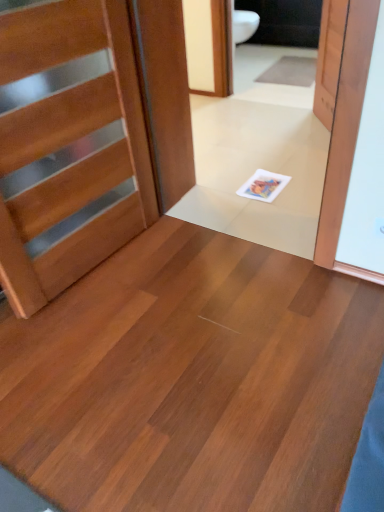
Question: Considering the relative sizes of wooden door at upper right, the 2th door when ordered from left to right, and gray carpet at upper center in the image provided, is wooden door at upper right, the 2th door when ordered from left to right, shorter than gray carpet at upper center?

Choices:
 (A) no
 (B) yes

Answer: (A)

Question: From the image's perspective, is wooden door at upper right, placed as the 1th door when sorted from back to front, under gray carpet at upper center?

Choices:
 (A) no
 (B) yes

Answer: (B)

Question: Considering the relative sizes of wooden door at upper right, which is the 1th door in right-to-left order, and gray carpet at upper center in the image provided, is wooden door at upper right, which is the 1th door in right-to-left order, wider than gray carpet at upper center?

Choices:
 (A) no
 (B) yes

Answer: (A)

Question: Considering the relative sizes of wooden door at upper right, placed as the 1th door when sorted from back to front, and gray carpet at upper center in the image provided, is wooden door at upper right, placed as the 1th door when sorted from back to front, bigger than gray carpet at upper center?

Choices:
 (A) yes
 (B) no

Answer: (A)

Question: From a real-world perspective, is wooden door at upper right, marked as the second door in a front-to-back arrangement, physically above gray carpet at upper center?

Choices:
 (A) no
 (B) yes

Answer: (B)

Question: Is wooden door at upper right, marked as the second door in a front-to-back arrangement, looking in the opposite direction of gray carpet at upper center?

Choices:
 (A) yes
 (B) no

Answer: (B)

Question: Can you confirm if wooden door at left, placed as the first door when sorted from front to back, is positioned to the right of matte wood floor at center?

Choices:
 (A) no
 (B) yes

Answer: (A)

Question: Is wooden door at left, which is counted as the 2th door, starting from the right, in front of matte wood floor at center?

Choices:
 (A) yes
 (B) no

Answer: (B)

Question: Are wooden door at left, marked as the second door in a back-to-front arrangement, and matte wood floor at center making contact?

Choices:
 (A) no
 (B) yes

Answer: (A)

Question: Is wooden door at left, placed as the first door when sorted from front to back, taller than matte wood floor at center?

Choices:
 (A) yes
 (B) no

Answer: (A)

Question: Is wooden door at left, which is counted as the 2th door, starting from the right, further to the viewer compared to matte wood floor at center?

Choices:
 (A) no
 (B) yes

Answer: (B)

Question: From the image's perspective, does wooden door at left, placed as the first door when sorted from front to back, appear lower than matte wood floor at center?

Choices:
 (A) no
 (B) yes

Answer: (A)

Question: Is wooden door at left, marked as the second door in a back-to-front arrangement, facing away from wooden door at upper right, marked as the second door in a front-to-back arrangement?

Choices:
 (A) yes
 (B) no

Answer: (B)